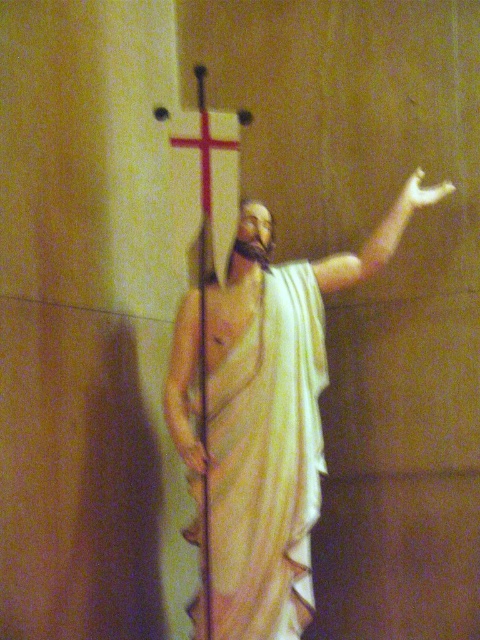
You are standing in a gallery and want to take a closer look at the matte white statue at center. The gallery has a rule that visitors must stay at least 2 meters away from all statues. Can you approach the statue without breaking the rule?

The matte white statue at center is currently 2.43 meters away from the viewer. Since the minimum required distance is 2 meters, you can move closer but must not go beyond the 2.43 meters to stay within the rule.

You are standing in front of a statue of Jesus Christ in a dimly lit room. You see the matte white statue at center and the white draped cloth at center. Which object is positioned to the right of the other?

The matte white statue at center is to the right of the white draped cloth at center.

You are an art conservator assessing the spacing between the matte white statue at center and the white draped cloth at center. According to the guidelines, the minimum recommended distance between such artifacts is 2 inches to prevent damage from vibrations. Is the current spacing sufficient?

The matte white statue at center is 1.66 inches away from the white draped cloth at center, which is below the minimum recommended distance of 2 inches. The current spacing is insufficient and may pose a risk of damage from vibrations.